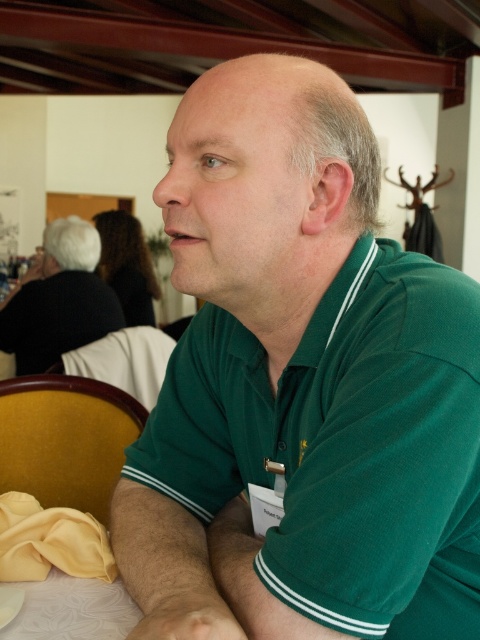
Question: Which point is closer to the camera taking this photo?

Choices:
 (A) (186, 488)
 (B) (45, 264)

Answer: (A)

Question: Is green smooth shirt at center to the left of green matte shirt at upper right from the viewer's perspective?

Choices:
 (A) yes
 (B) no

Answer: (B)

Question: Can you confirm if green smooth shirt at center is positioned to the right of green matte shirt at upper right?

Choices:
 (A) no
 (B) yes

Answer: (B)

Question: Does green smooth shirt at center lie behind green matte shirt at upper right?

Choices:
 (A) no
 (B) yes

Answer: (A)